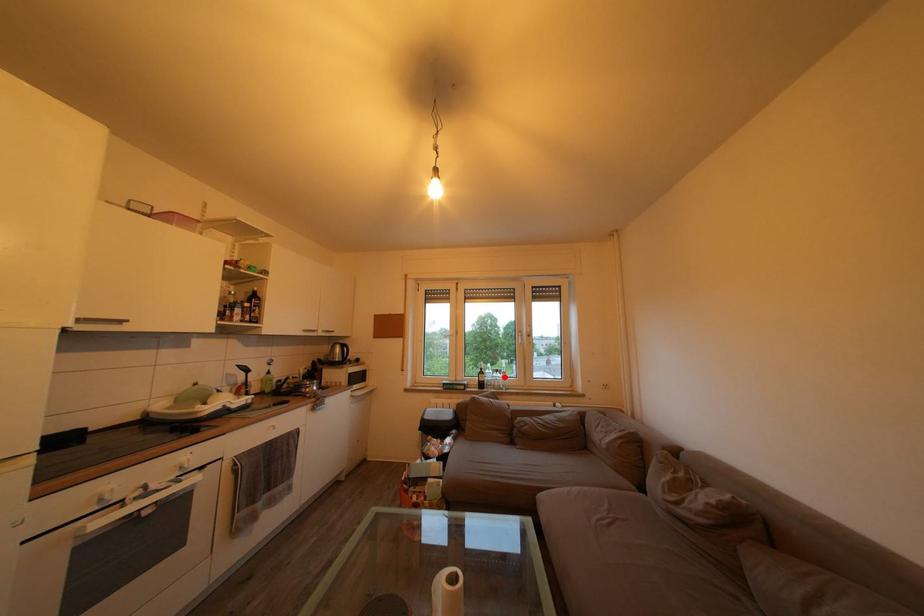
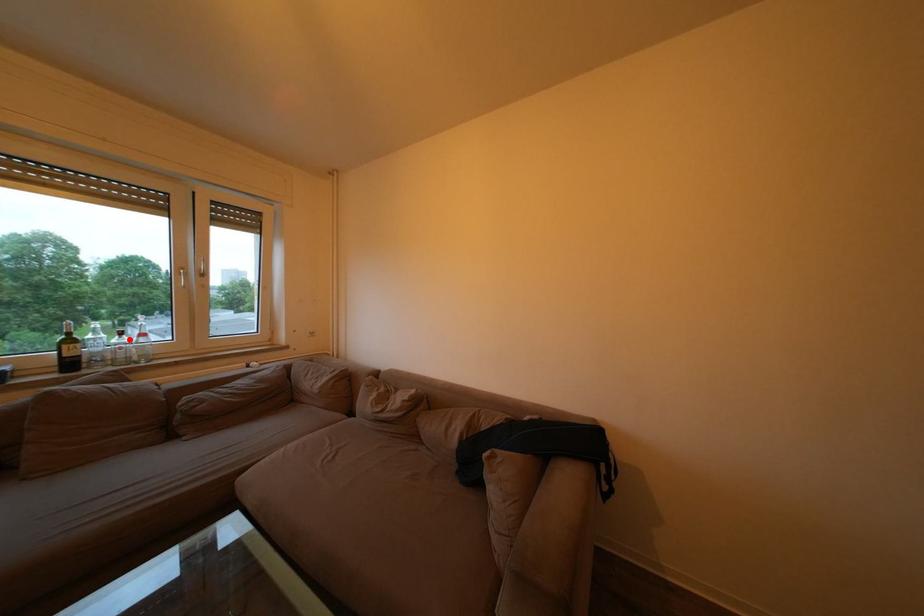
I am providing you with two images of the same scene from different viewpoints. A red point is marked on the first image and another point is marked on the second image. Does the point marked in image1 correspond to the same location as the one in image2?

Yes